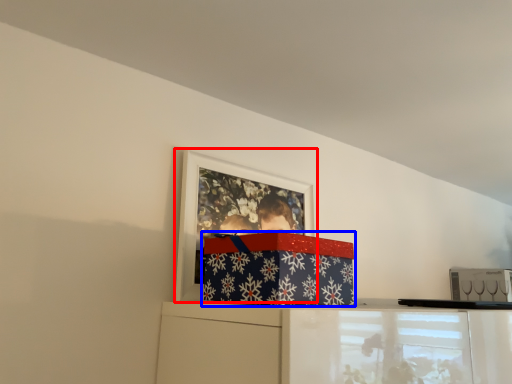
Question: Among these objects, which one is nearest to the camera, picture frame (highlighted by a red box) or package (highlighted by a blue box)?

Choices:
 (A) picture frame
 (B) package

Answer: (B)